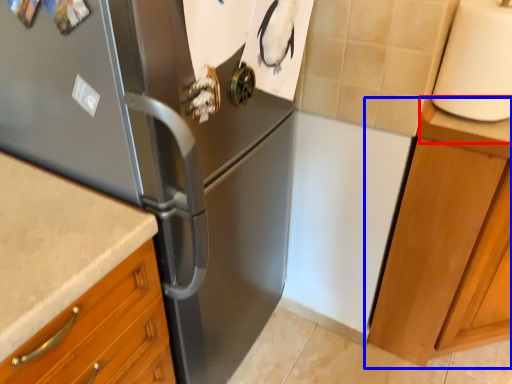
Question: Which object appears farthest to the camera in this image, counter top (highlighted by a red box) or cabinetry (highlighted by a blue box)?

Choices:
 (A) counter top
 (B) cabinetry

Answer: (A)